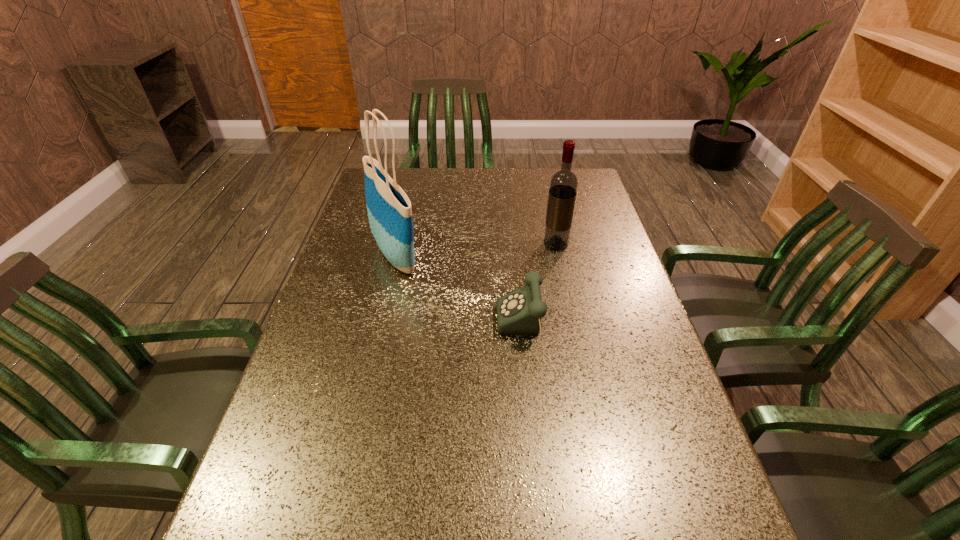
You are a GUI agent. You are given a task and a screenshot of the screen. Output one action in this format:
    pyautogui.click(x=<x>, y=<y>)
    Task: Click on the tallest object
    The image size is (960, 540).
    Given the screenshot: What is the action you would take?
    pyautogui.click(x=389, y=209)

This screenshot has width=960, height=540. I want to click on the leftmost object, so click(x=389, y=209).

Where is `wine bottle`? This screenshot has width=960, height=540. wine bottle is located at coordinates (563, 187).

Find the location of a particular element. Image resolution: width=960 pixels, height=540 pixels. the second shortest object is located at coordinates (563, 187).

Identify the location of the shortest object. (519, 312).

The image size is (960, 540). I want to click on the second object from left to right, so click(519, 312).

Identify the location of free point located on the front of the tallest object. This screenshot has height=540, width=960. (385, 303).

Image resolution: width=960 pixels, height=540 pixels. I want to click on vacant space located 0.110m on the front of the rightmost object, so pyautogui.click(x=563, y=276).

What are the coordinates of `vacant space located on the dial of the second object from left to right` in the screenshot? It's located at (396, 331).

Find the location of `free space located 0.070m on the dial of the second object from left to right`. free space located 0.070m on the dial of the second object from left to right is located at coordinates (468, 331).